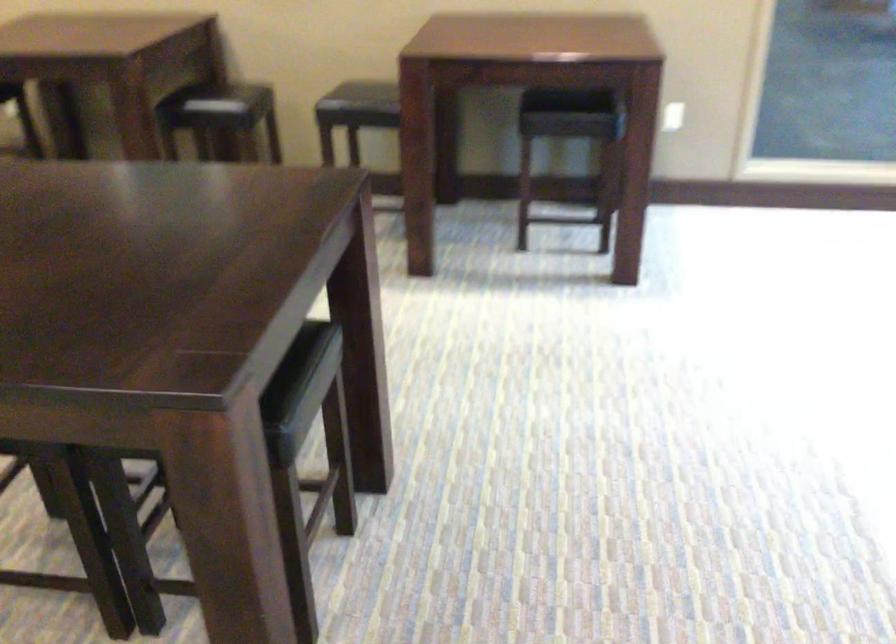
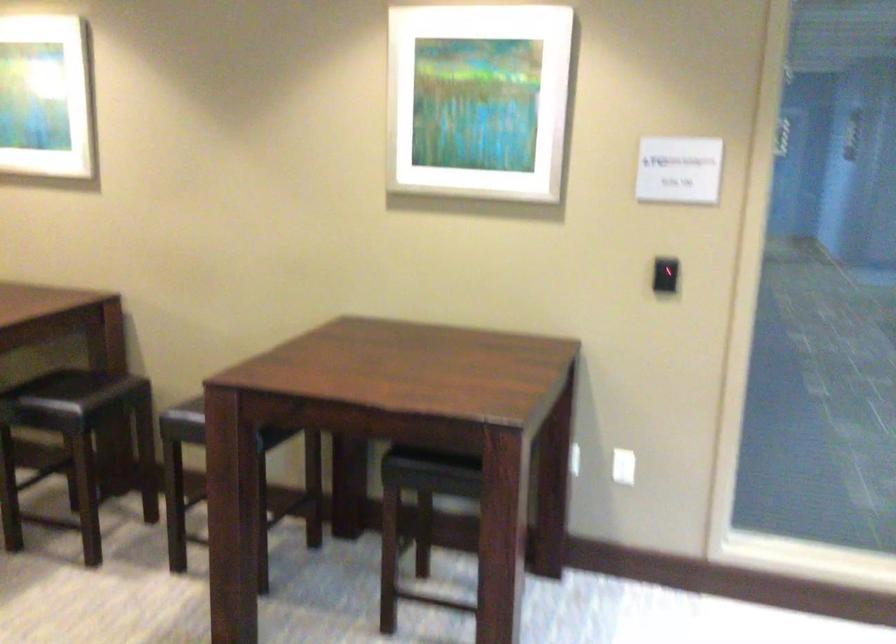
Where in the second image is the point corresponding to pixel 675 114 from the first image?

(623, 466)